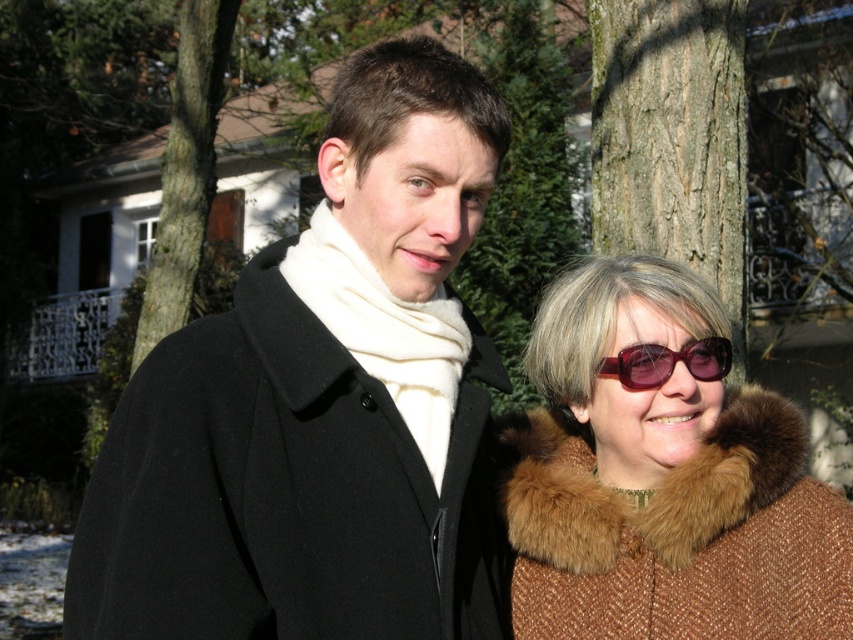
Question: Is smooth bark tree at upper center smaller than burgundy plastic sunglasses at right?

Choices:
 (A) no
 (B) yes

Answer: (A)

Question: Estimate the real-world distances between objects in this image. Which object is closer to the burgundy plastic sunglasses at right?

Choices:
 (A) black wool coat at center
 (B) brown textured bark at upper left

Answer: (A)

Question: Is brown woolen coat at center to the right of smooth bark tree at upper center from the viewer's perspective?

Choices:
 (A) no
 (B) yes

Answer: (A)

Question: Does brown textured bark at upper left have a larger size compared to burgundy plastic sunglasses at right?

Choices:
 (A) no
 (B) yes

Answer: (B)

Question: Among these objects, which one is nearest to the camera?

Choices:
 (A) brown woolen coat at center
 (B) brown textured bark at upper left

Answer: (A)

Question: Among these points, which one is farthest from the camera?

Choices:
 (A) (276, 316)
 (B) (648, 252)

Answer: (B)